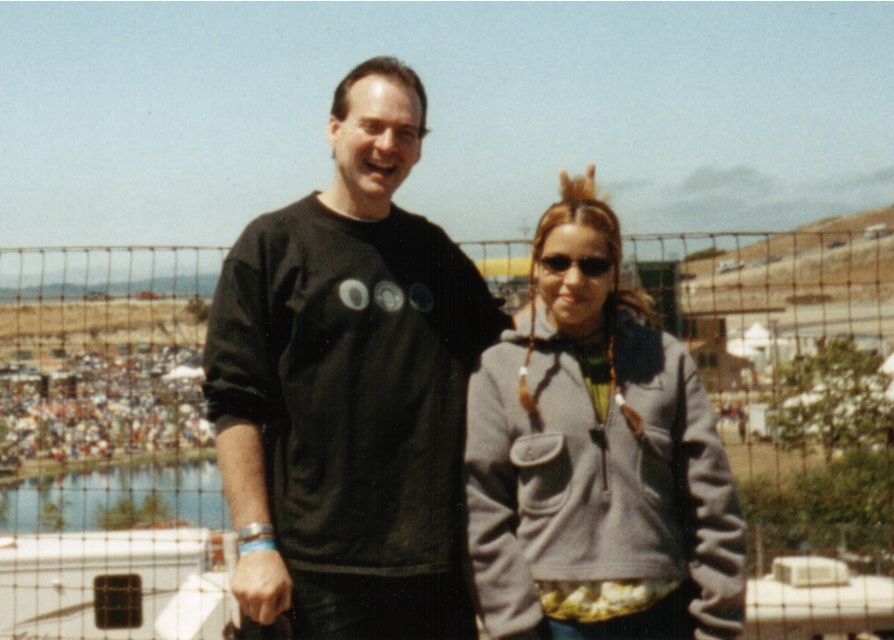
Question: Can you confirm if gray fleece jacket at center is smaller than black plastic sunglasses at upper center?

Choices:
 (A) no
 (B) yes

Answer: (A)

Question: Does metal mesh fence at center have a greater width compared to gray fleece jacket at center?

Choices:
 (A) yes
 (B) no

Answer: (A)

Question: Which point is closer to the camera?

Choices:
 (A) black plastic sunglasses at upper center
 (B) gray fleece jacket at center
 (C) metal mesh fence at center
 (D) black matte shirt at center

Answer: (D)

Question: Can you confirm if metal mesh fence at center is smaller than gray fleece jacket at center?

Choices:
 (A) yes
 (B) no

Answer: (B)

Question: Estimate the real-world distances between objects in this image. Which object is closer to the black plastic sunglasses at upper center?

Choices:
 (A) gray fleece jacket at center
 (B) black matte shirt at center
 (C) metal mesh fence at center

Answer: (A)

Question: Which point is closer to the camera?

Choices:
 (A) black plastic sunglasses at upper center
 (B) black matte shirt at center
 (C) metal mesh fence at center
 (D) gray fleece jacket at center

Answer: (B)